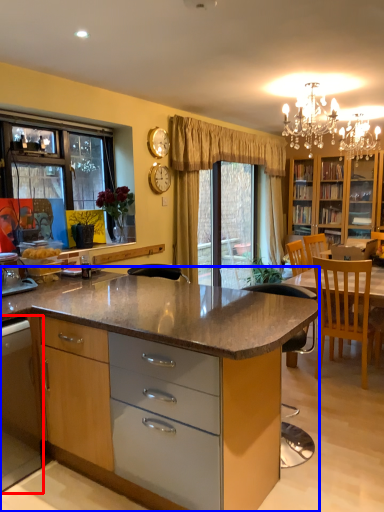
Question: Among these objects, which one is farthest to the camera, cabinetry (highlighted by a red box) or cabinetry (highlighted by a blue box)?

Choices:
 (A) cabinetry
 (B) cabinetry

Answer: (A)